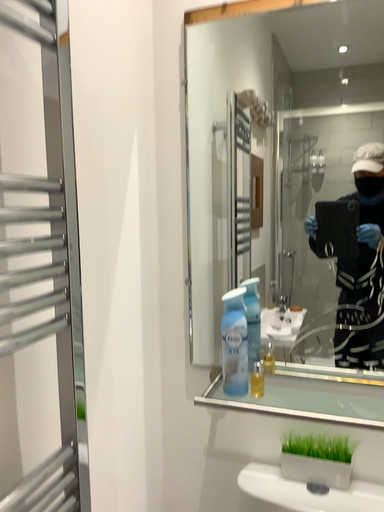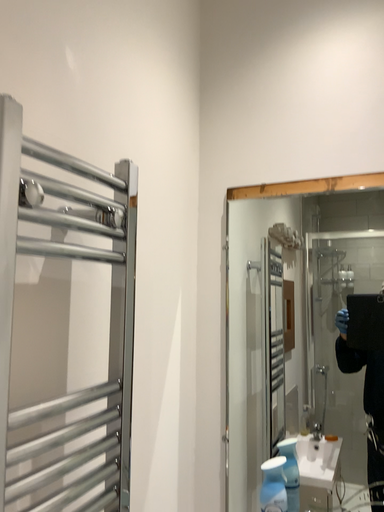
Question: Which way did the camera rotate in the video?

Choices:
 (A) rotated downward
 (B) rotated upward

Answer: (B)